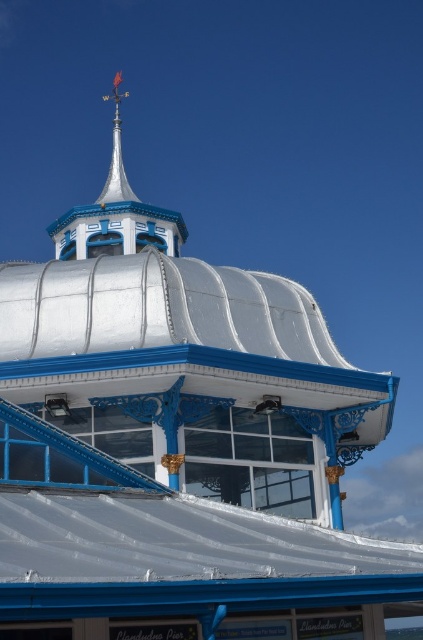
Question: Is the position of shiny blue spire at upper center more distant than that of shiny silver spire at top?

Choices:
 (A) no
 (B) yes

Answer: (A)

Question: Does shiny blue spire at upper center appear on the left side of shiny silver spire at top?

Choices:
 (A) no
 (B) yes

Answer: (B)

Question: Among these objects, which one is nearest to the camera?

Choices:
 (A) shiny blue spire at upper center
 (B) shiny silver spire at top

Answer: (A)

Question: Among these points, which one is farthest from the camera?

Choices:
 (A) (98, 200)
 (B) (115, 180)

Answer: (A)

Question: Does shiny blue spire at upper center have a greater width compared to shiny silver spire at top?

Choices:
 (A) no
 (B) yes

Answer: (B)